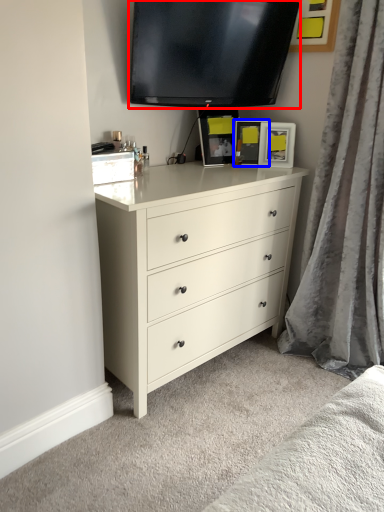
Question: Which object appears closest to the camera in this image, television (highlighted by a red box) or picture frame (highlighted by a blue box)?

Choices:
 (A) television
 (B) picture frame

Answer: (A)